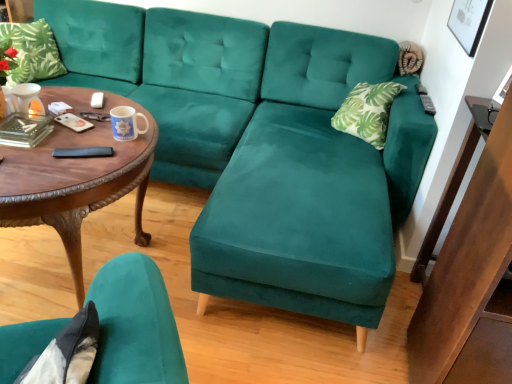
Question: From a real-world perspective, is velvet teal chair at lower left positioned above or below green leafy fabric pillow at upper left?

Choices:
 (A) below
 (B) above

Answer: (A)

Question: From the image's perspective, relative to green leafy fabric pillow at upper left, is velvet teal chair at lower left above or below?

Choices:
 (A) above
 (B) below

Answer: (B)

Question: Which object is positioned farthest from the green leafy fabric pillow at upper left?

Choices:
 (A) velvet teal chair at lower left
 (B) woodencoffee table at left
 (C) wooden side table at right

Answer: (C)

Question: Which object is positioned farthest from the green leafy fabric pillow at upper left?

Choices:
 (A) velvet teal chair at lower left
 (B) woodencoffee table at left
 (C) wooden side table at right

Answer: (C)